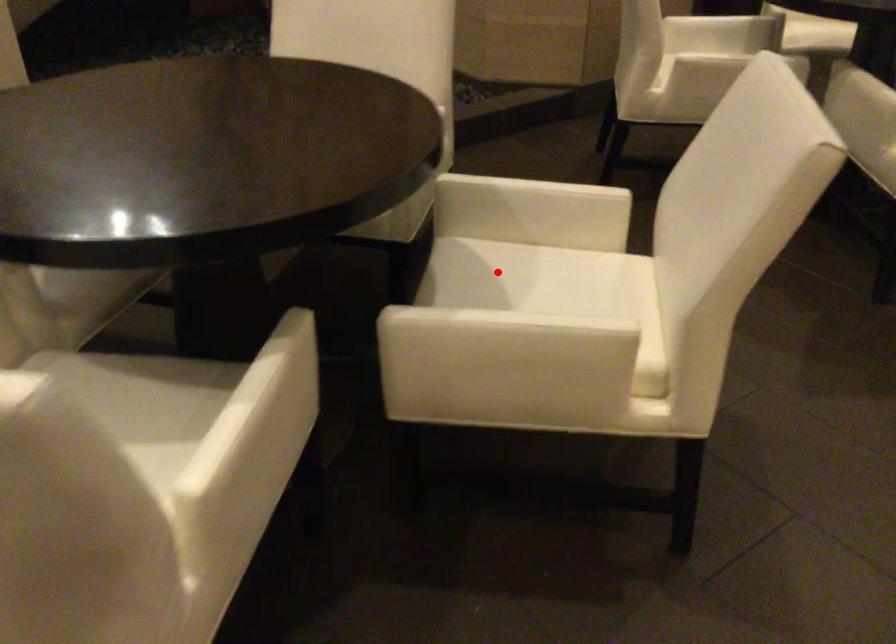
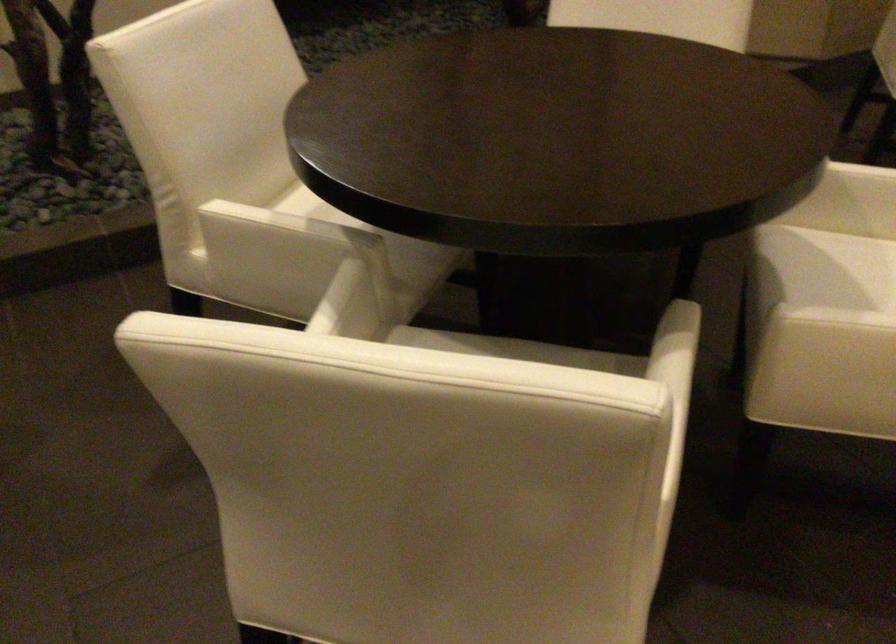
The point at the highlighted location is marked in the first image. Where is the corresponding point in the second image?

(855, 266)